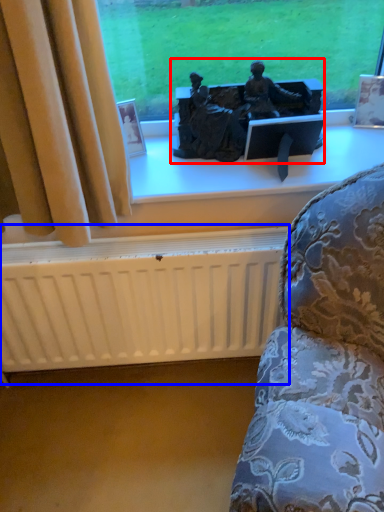
Question: Which of the following is the farthest to the observer, sculpture (highlighted by a red box) or radiator (highlighted by a blue box)?

Choices:
 (A) sculpture
 (B) radiator

Answer: (B)